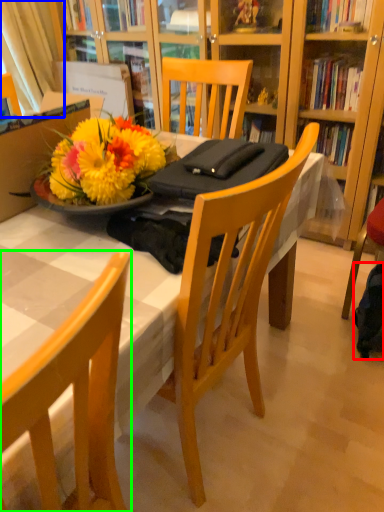
Question: Which object is positioned closest to backpack (highlighted by a red box)? Select from curtain (highlighted by a blue box) and chair (highlighted by a green box).

Choices:
 (A) curtain
 (B) chair

Answer: (B)